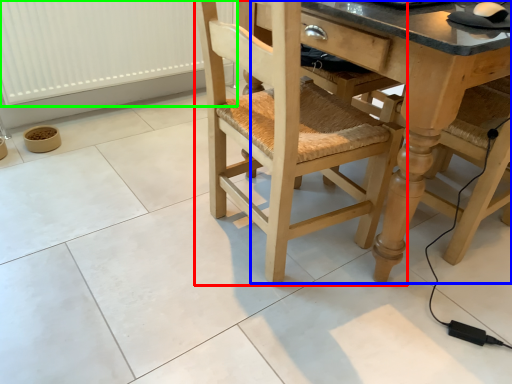
Question: Based on their relative distances, which object is farther from chair (highlighted by a red box)? Choose from counter top (highlighted by a blue box) and radiator (highlighted by a green box).

Choices:
 (A) counter top
 (B) radiator

Answer: (B)